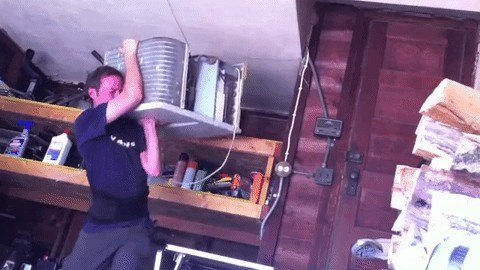
This screenshot has width=480, height=270. I want to click on shelves, so click(x=245, y=215), click(x=252, y=152).